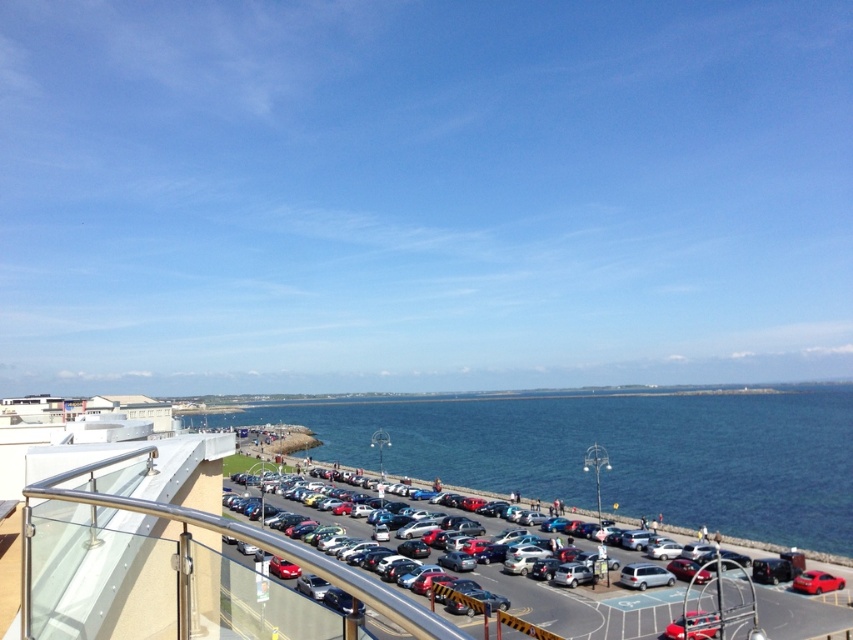
Is metallic cars at center shorter than shiny red car at lower right?

Incorrect, metallic cars at center's height does not fall short of shiny red car at lower right's.

Is metallic cars at center wider than shiny red car at lower right?

Yes, metallic cars at center is wider than shiny red car at lower right.

Locate an element on the screen. Image resolution: width=853 pixels, height=640 pixels. metallic cars at center is located at coordinates (572, 605).

Is blue water at center further to the viewer compared to metallic cars at center?

Yes, blue water at center is further from the viewer.

Where is `blue water at center`? blue water at center is located at coordinates (616, 452).

The width and height of the screenshot is (853, 640). What are the coordinates of `blue water at center` in the screenshot? It's located at (616, 452).

Can you confirm if blue water at center is positioned to the right of shiny red car at lower right?

Correct, you'll find blue water at center to the right of shiny red car at lower right.

The image size is (853, 640). In order to click on blue water at center in this screenshot , I will do `click(616, 452)`.